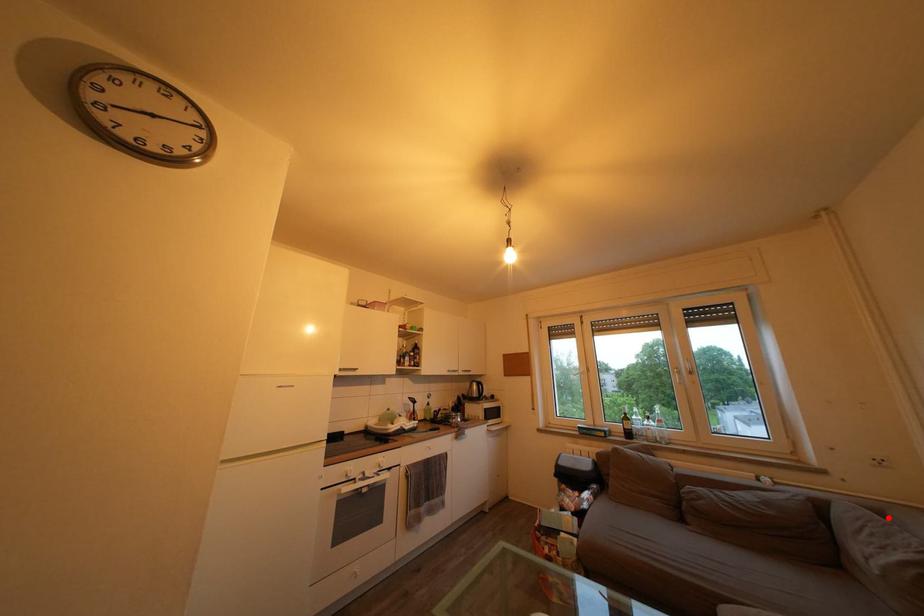
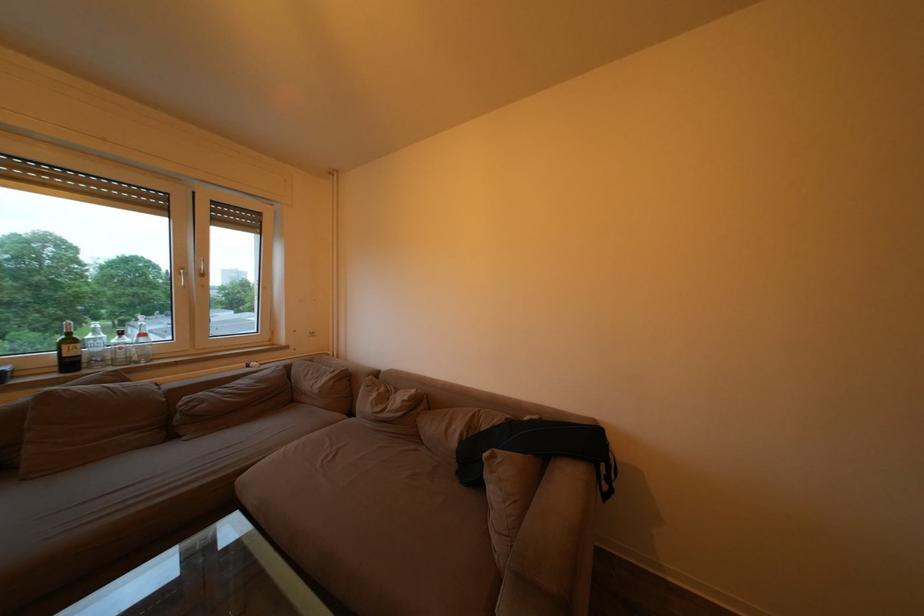
In the second image, find the point that corresponds to the highlighted location in the first image.

(319, 367)